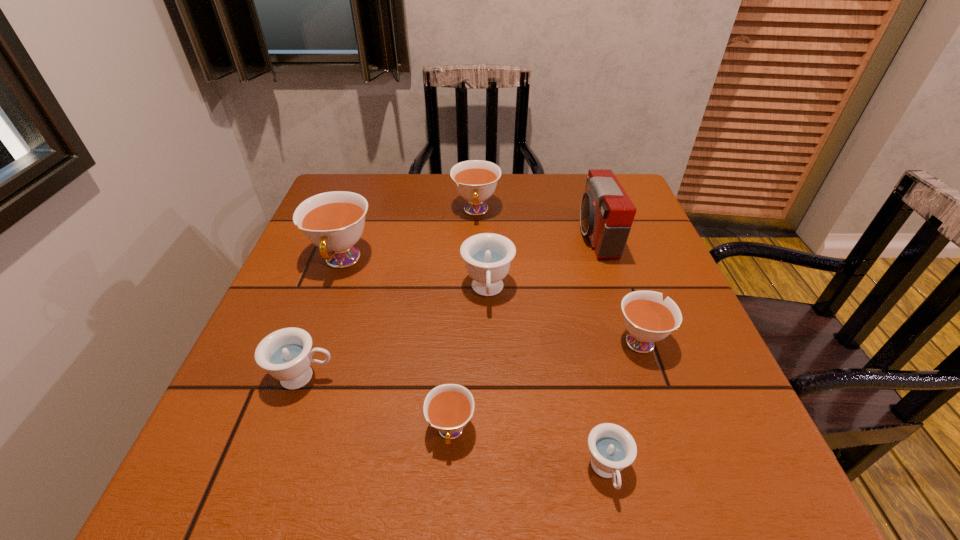
This screenshot has width=960, height=540. What are the coordinates of `free space between the second blue teacup from left to right and the rightmost white teacup` in the screenshot? It's located at (564, 315).

This screenshot has width=960, height=540. I want to click on free space between the third nearest white teacup and the smallest white teacup, so click(396, 346).

Locate an element on the screen. Image resolution: width=960 pixels, height=540 pixels. object that is the fourth closest to the smallest white teacup is located at coordinates (648, 319).

Locate which object ranks in proximity to the second biggest white teacup. Please provide its 2D coordinates. Your answer should be formatted as a tuple, i.e. [(x, y)], where the tuple contains the x and y coordinates of a point satisfying the conditions above.

[(487, 256)]

What are the coordinates of `the seventh closest teacup to the camera` in the screenshot? It's located at (286, 354).

At what (x,y) coordinates should I click in order to perform the action: click on teacup that is the second closest to the second blue teacup from right to left. Please return your answer as a coordinate pair (x, y). Looking at the image, I should click on (648, 319).

At what (x,y) coordinates should I click in order to perform the action: click on white teacup that is the closest to the camera. Please return your answer as a coordinate pair (x, y). Looking at the image, I should click on (648, 319).

Locate which white teacup is the second closest to the nearest white teacup. Please provide its 2D coordinates. Your answer should be formatted as a tuple, i.e. [(x, y)], where the tuple contains the x and y coordinates of a point satisfying the conditions above.

[(334, 221)]

Choose which blue teacup is the third nearest neighbor to the third smallest white teacup. Please provide its 2D coordinates. Your answer should be formatted as a tuple, i.e. [(x, y)], where the tuple contains the x and y coordinates of a point satisfying the conditions above.

[(612, 448)]

You are a GUI agent. You are given a task and a screenshot of the screen. Output one action in this format:
    pyautogui.click(x=<x>, y=<y>)
    Task: Click on the blue teacup that is the second closest one to the second smallest blue teacup
    Image resolution: width=960 pixels, height=540 pixels.
    Given the screenshot: What is the action you would take?
    pyautogui.click(x=612, y=448)